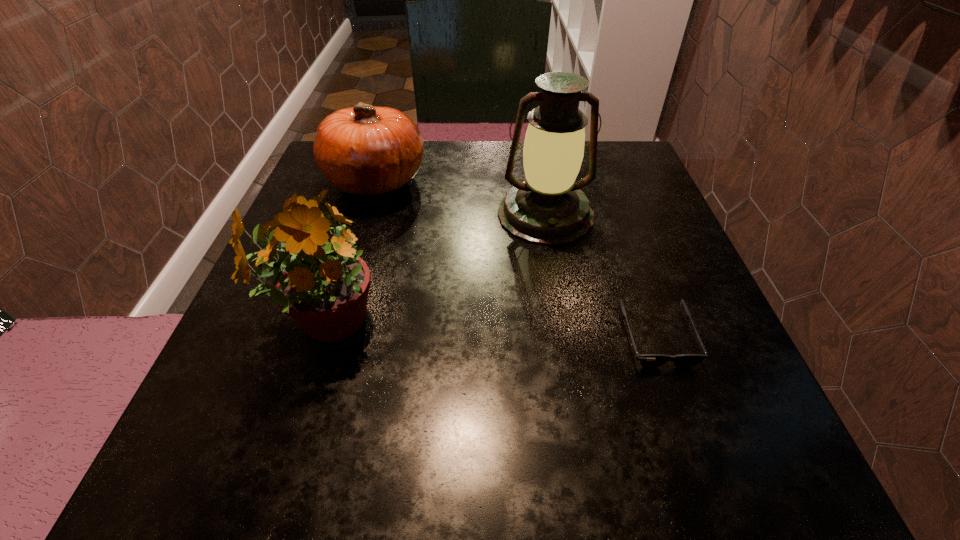
Locate an element on the screen. This screenshot has width=960, height=540. vacant space at the near left corner of the desktop is located at coordinates (224, 457).

Where is `vacant area that lies between the lantern and the flowerpot`? The image size is (960, 540). vacant area that lies between the lantern and the flowerpot is located at coordinates (435, 268).

This screenshot has height=540, width=960. What are the coordinates of `empty space that is in between the shortest object and the flowerpot` in the screenshot? It's located at (490, 330).

Identify the location of free space between the lantern and the flowerpot. Image resolution: width=960 pixels, height=540 pixels. (435, 268).

The image size is (960, 540). Find the location of `empty space between the lantern and the shortest object`. empty space between the lantern and the shortest object is located at coordinates (601, 277).

In order to click on free area in between the lantern and the flowerpot in this screenshot , I will do `click(435, 268)`.

Where is `free area in between the pumpkin and the shortest object`? This screenshot has height=540, width=960. free area in between the pumpkin and the shortest object is located at coordinates pyautogui.click(x=516, y=260).

At what (x,y) coordinates should I click in order to perform the action: click on free spot between the pumpkin and the shortest object. Please return your answer as a coordinate pair (x, y). Image resolution: width=960 pixels, height=540 pixels. Looking at the image, I should click on (516, 260).

This screenshot has height=540, width=960. In order to click on vacant area between the lantern and the flowerpot in this screenshot , I will do `click(435, 268)`.

Locate an element on the screen. the second closest object relative to the lantern is located at coordinates [x=646, y=360].